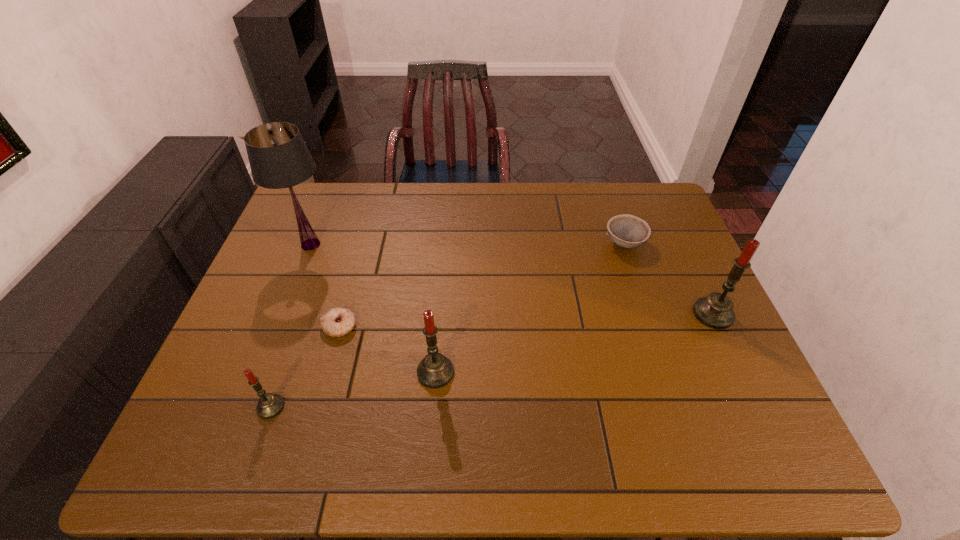
This screenshot has width=960, height=540. I want to click on the nearest object, so [269, 405].

Find the location of a particular element. This screenshot has height=540, width=960. the third shortest object is located at coordinates (269, 405).

Find the location of a particular element. The image size is (960, 540). the fifth farthest object is located at coordinates (435, 371).

Identify the location of the second nearest candle. (435, 371).

This screenshot has height=540, width=960. What are the coordinates of `the rightmost candle` in the screenshot? It's located at (716, 311).

Locate an element on the screen. This screenshot has height=540, width=960. the rightmost object is located at coordinates 716,311.

Locate an element on the screen. The width and height of the screenshot is (960, 540). lampshade is located at coordinates (278, 156).

Where is `the second shortest object`? This screenshot has height=540, width=960. the second shortest object is located at coordinates (627, 231).

In order to click on bowl in this screenshot , I will do `click(627, 231)`.

At what (x,y) coordinates should I click in order to perform the action: click on doughnut. Please return your answer as a coordinate pair (x, y). Looking at the image, I should click on (338, 321).